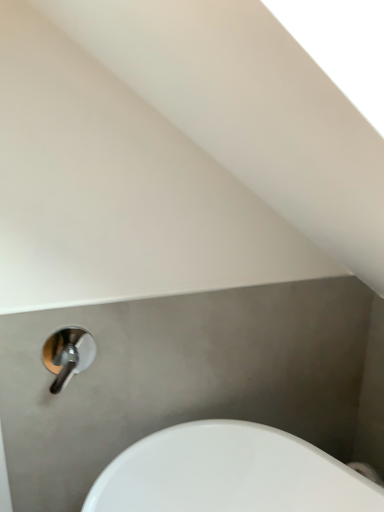
Question: From the image's perspective, is polished chrome tap at lower left located above or below white glossy sink at lower left?

Choices:
 (A) above
 (B) below

Answer: (A)

Question: Looking at the image, does polished chrome tap at lower left seem bigger or smaller compared to white glossy sink at lower left?

Choices:
 (A) big
 (B) small

Answer: (B)

Question: Considering the positions of point (69, 344) and point (188, 451), is point (69, 344) closer or farther from the camera than point (188, 451)?

Choices:
 (A) closer
 (B) farther

Answer: (A)

Question: From a real-world perspective, is white glossy sink at lower left positioned above or below polished chrome tap at lower left?

Choices:
 (A) above
 (B) below

Answer: (B)

Question: Is point (281, 449) closer or farther from the camera than point (87, 338)?

Choices:
 (A) closer
 (B) farther

Answer: (A)

Question: In terms of width, does white glossy sink at lower left look wider or thinner when compared to polished chrome tap at lower left?

Choices:
 (A) wide
 (B) thin

Answer: (A)

Question: Based on their sizes in the image, would you say white glossy sink at lower left is bigger or smaller than polished chrome tap at lower left?

Choices:
 (A) big
 (B) small

Answer: (A)